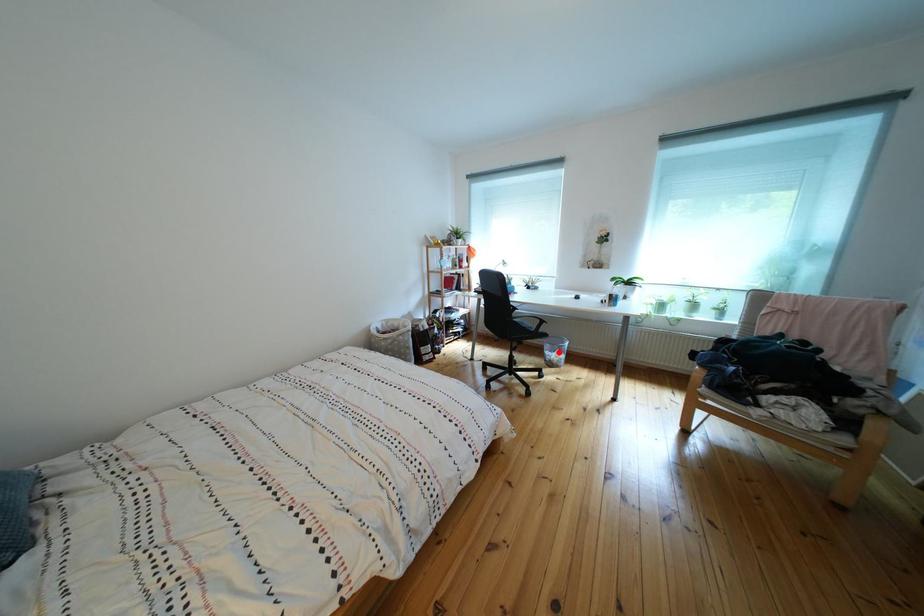
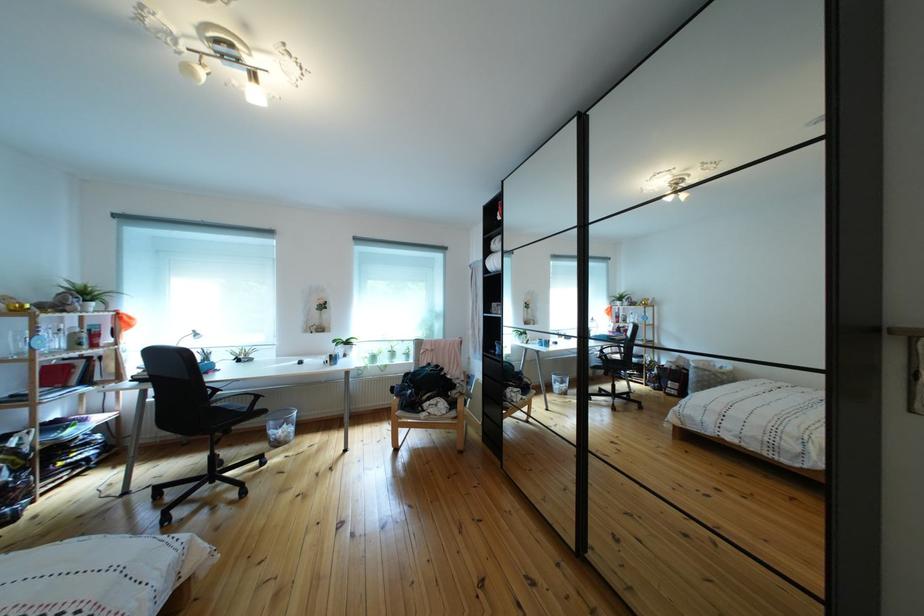
Question: I am providing you with two images of the same scene from different viewpoints. A red point is shown in image1. For the corresponding object point in image2, is it positioned nearer or farther from the camera?

Choices:
 (A) Nearer
 (B) Farther

Answer: (A)